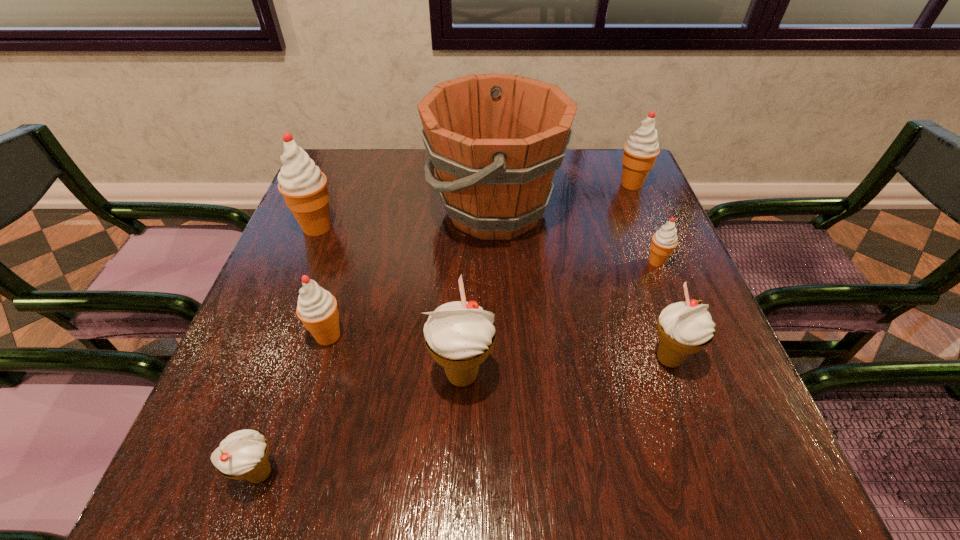
You are a GUI agent. You are given a task and a screenshot of the screen. Output one action in this format:
    pyautogui.click(x=<x>, y=<y>)
    Task: Click on the third farthest red icecream
    The image size is (960, 540).
    Given the screenshot: What is the action you would take?
    pyautogui.click(x=664, y=241)

Where is `the smallest red icecream`? This screenshot has height=540, width=960. the smallest red icecream is located at coordinates (664, 241).

Image resolution: width=960 pixels, height=540 pixels. Identify the location of the leftmost white icecream. (243, 454).

Where is `the nearest icecream`? Image resolution: width=960 pixels, height=540 pixels. the nearest icecream is located at coordinates (243, 454).

The image size is (960, 540). What are the coordinates of `vacant space located 0.280m on the handle side of the bucket` in the screenshot? It's located at (319, 210).

At what (x,y) coordinates should I click in order to perform the action: click on free space located on the handle side of the bucket. Please return your answer as a coordinate pair (x, y). Looking at the image, I should click on (326, 210).

Locate an element on the screen. The image size is (960, 540). free spot located on the handle side of the bucket is located at coordinates (346, 210).

The height and width of the screenshot is (540, 960). Identify the location of free space located 0.350m on the right of the tallest icecream. (481, 227).

The height and width of the screenshot is (540, 960). Identify the location of free location located 0.150m on the left of the farthest red icecream. (561, 184).

I want to click on free space located 0.170m on the right of the second white icecream from left to right, so click(588, 375).